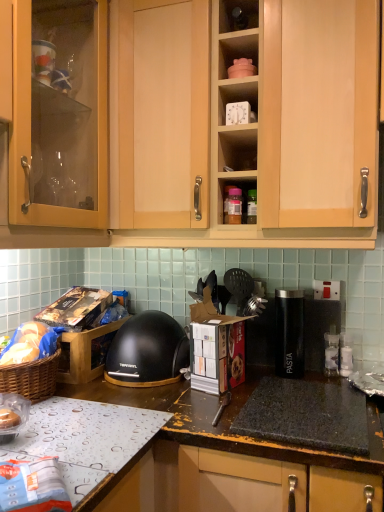
Question: Considering the relative sizes of light wood cabinet at upper center and clear plastic bag at lower left in the image provided, is light wood cabinet at upper center shorter than clear plastic bag at lower left?

Choices:
 (A) no
 (B) yes

Answer: (A)

Question: Is light wood cabinet at upper center at the right side of clear plastic bag at lower left?

Choices:
 (A) no
 (B) yes

Answer: (B)

Question: Is light wood cabinet at upper center not inside clear plastic bag at lower left?

Choices:
 (A) yes
 (B) no

Answer: (A)

Question: Considering the relative sizes of light wood cabinet at upper center and clear plastic bag at lower left in the image provided, is light wood cabinet at upper center bigger than clear plastic bag at lower left?

Choices:
 (A) yes
 (B) no

Answer: (A)

Question: Is light wood cabinet at upper center oriented away from clear plastic bag at lower left?

Choices:
 (A) no
 (B) yes

Answer: (A)

Question: Is point (8, 229) closer or farther from the camera than point (230, 11)?

Choices:
 (A) farther
 (B) closer

Answer: (B)

Question: From a real-world perspective, is light wood cabinet at upper center physically located above or below matte plastic container at upper center, the first shelf positioned from the top?

Choices:
 (A) below
 (B) above

Answer: (A)

Question: Is light wood cabinet at upper center inside or outside of matte plastic container at upper center, the first shelf positioned from the top?

Choices:
 (A) outside
 (B) inside

Answer: (A)

Question: From the image's perspective, is light wood cabinet at upper center positioned above or below matte plastic container at upper center, the first shelf positioned from the top?

Choices:
 (A) below
 (B) above

Answer: (A)

Question: Relative to white plastic clock at upper center, the 2th shelf from the top, is clear plastic bag at lower left in front or behind?

Choices:
 (A) front
 (B) behind

Answer: (A)

Question: Does point (29, 401) appear closer or farther from the camera than point (248, 97)?

Choices:
 (A) closer
 (B) farther

Answer: (A)

Question: Is clear plastic bag at lower left taller or shorter than white plastic clock at upper center, the first shelf in the bottom-to-top sequence?

Choices:
 (A) short
 (B) tall

Answer: (A)

Question: Is clear plastic bag at lower left wider or thinner than white plastic clock at upper center, the first shelf in the bottom-to-top sequence?

Choices:
 (A) wide
 (B) thin

Answer: (A)

Question: Considering the relative positions of white plastic clock at upper center, the 2th shelf from the top, and black matte helmet at center in the image provided, is white plastic clock at upper center, the 2th shelf from the top, to the left or to the right of black matte helmet at center?

Choices:
 (A) left
 (B) right

Answer: (B)

Question: Is white plastic clock at upper center, the first shelf in the bottom-to-top sequence, wider or thinner than black matte helmet at center?

Choices:
 (A) thin
 (B) wide

Answer: (A)